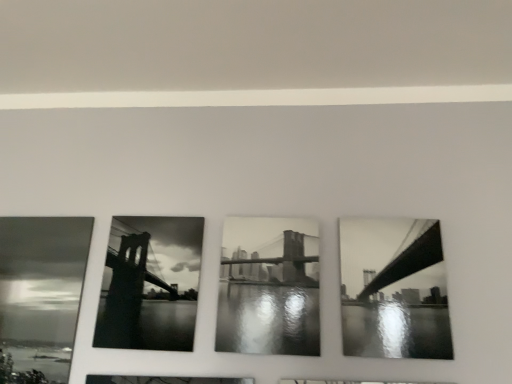
Question: From the image's perspective, is black glossy bridge at right, which is the third picture frame in left-to-right order, positioned above or below black glossy photo frame at center, arranged as the 1th picture frame when viewed from the left?

Choices:
 (A) above
 (B) below

Answer: (A)

Question: Relative to black glossy photo frame at center, arranged as the 1th picture frame when viewed from the left, is black glossy bridge at right, positioned as the 1th picture frame in right-to-left order, in front or behind?

Choices:
 (A) behind
 (B) front

Answer: (B)

Question: Based on their relative distances, which object is nearer to the black glossy photo frame at center, arranged as the 1th picture frame when viewed from the left?

Choices:
 (A) black glossy bridge at right, positioned as the 1th picture frame in right-to-left order
 (B) black and white photograph of bridge at center, placed as the second picture frame when sorted from right to left

Answer: (B)

Question: Based on their relative distances, which object is farther from the black glossy bridge at right, positioned as the 1th picture frame in right-to-left order?

Choices:
 (A) black and white photograph of bridge at center, which appears as the second picture frame when viewed from the left
 (B) black glossy photo frame at center, placed as the 3th picture frame when sorted from right to left

Answer: (B)